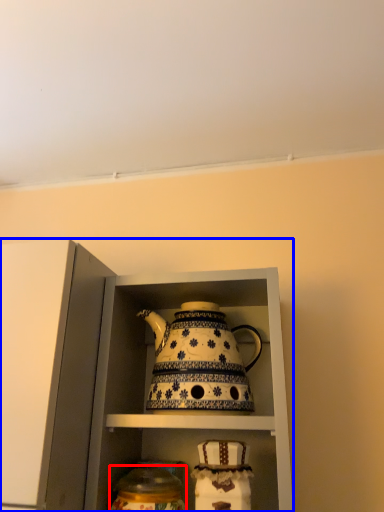
Question: Which object is closer to the camera taking this photo, tableware (highlighted by a red box) or cabinetry (highlighted by a blue box)?

Choices:
 (A) tableware
 (B) cabinetry

Answer: (B)